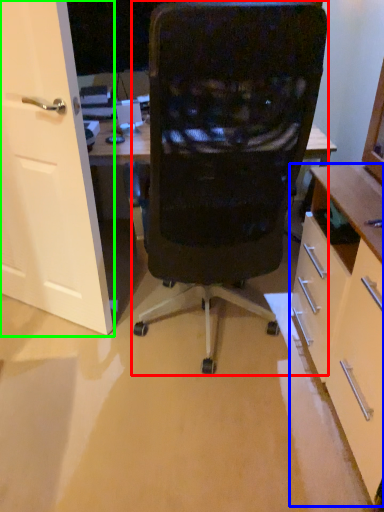
Question: Which object is the closest to the chair (highlighted by a red box)? Choose among these: cabinetry (highlighted by a blue box) or door (highlighted by a green box).

Choices:
 (A) cabinetry
 (B) door

Answer: (A)